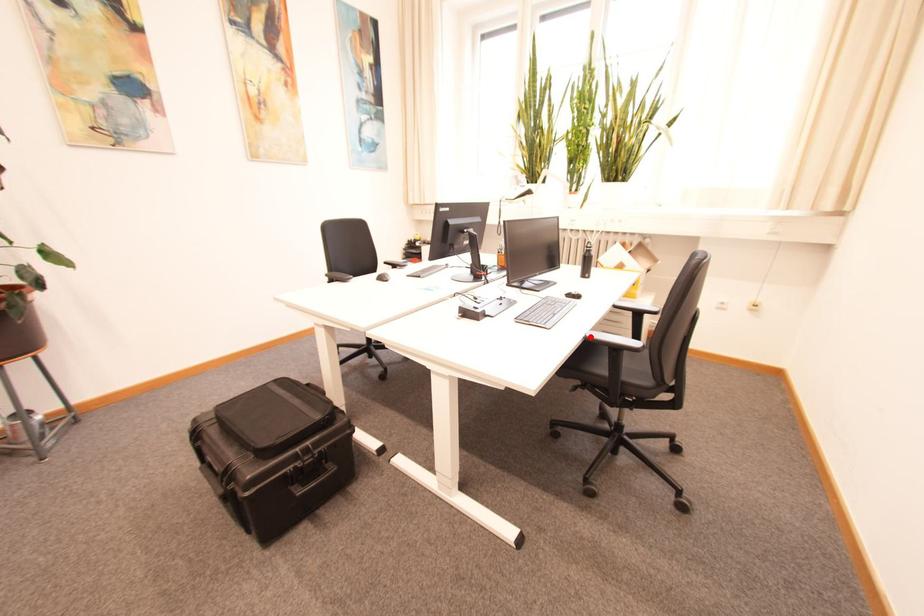
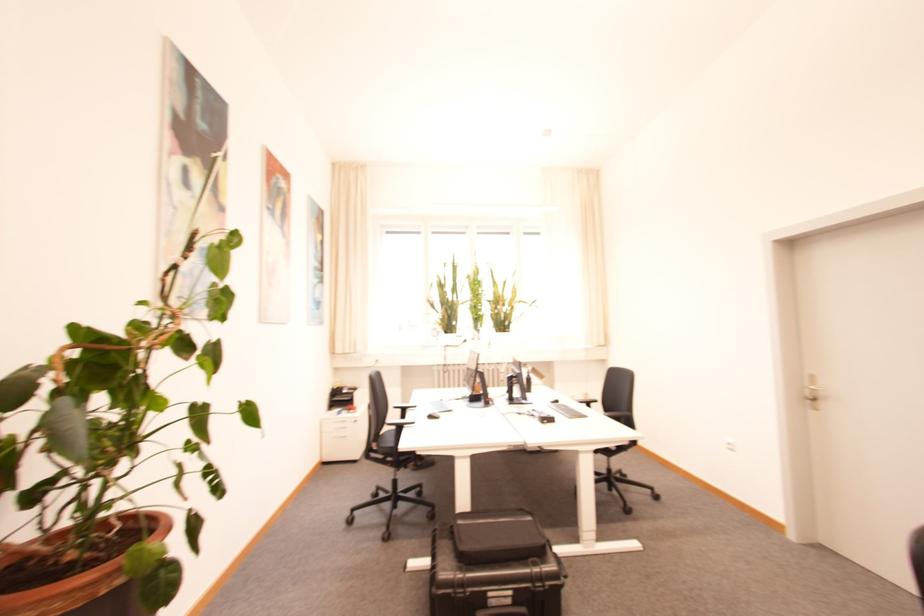
Question: I am providing you with two images of the same scene from different viewpoints. A red point is marked on the first image. At the location where the point appears in image 1, is it still visible in image 2?

Choices:
 (A) Yes
 (B) No

Answer: (B)